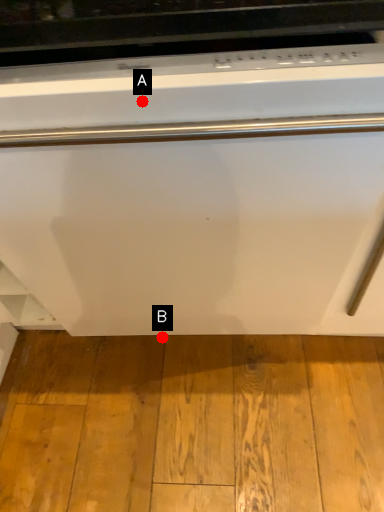
Question: Two points are circled on the image, labeled by A and B beside each circle. Among these points, which one is nearest to the camera?

Choices:
 (A) A is closer
 (B) B is closer

Answer: (A)